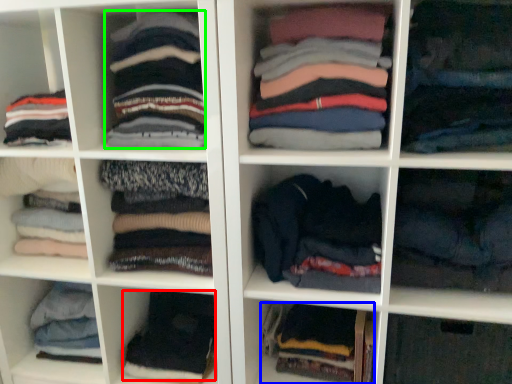
Question: Based on their relative distances, which object is nearer to clothing (highlighted by a red box)? Choose from clothing (highlighted by a blue box) and clothing (highlighted by a green box).

Choices:
 (A) clothing
 (B) clothing

Answer: (A)